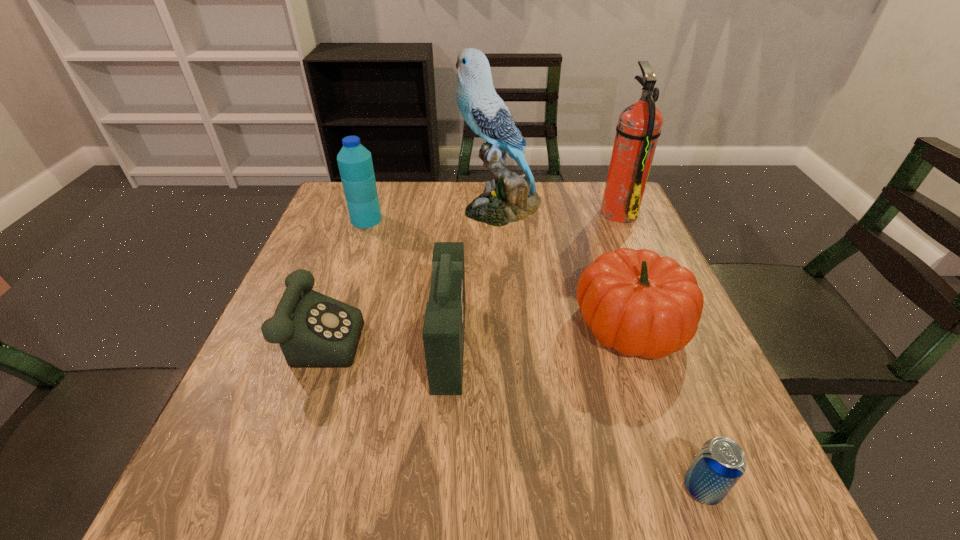
The height and width of the screenshot is (540, 960). Find the location of `parakeet`. parakeet is located at coordinates (508, 198).

Locate an element on the screen. fire extinguisher is located at coordinates coord(639,125).

This screenshot has width=960, height=540. I want to click on water bottle, so click(x=355, y=164).

At what (x,y) coordinates should I click in order to perform the action: click on the first-aid kit. Please return your answer as a coordinate pair (x, y). Looking at the image, I should click on (443, 331).

Identify the location of the fifth tallest object. This screenshot has width=960, height=540. 634,301.

Identify the location of telephone. This screenshot has height=540, width=960. (313, 330).

Locate an element on the screen. Image resolution: width=960 pixels, height=540 pixels. the nearest object is located at coordinates (720, 463).

Locate an element on the screen. beer can is located at coordinates (720, 463).

In order to click on free space located 0.330m on the face of the parakeet in this screenshot , I will do `click(345, 207)`.

Where is `free spot located 0.100m on the face of the parakeet`? free spot located 0.100m on the face of the parakeet is located at coordinates (425, 207).